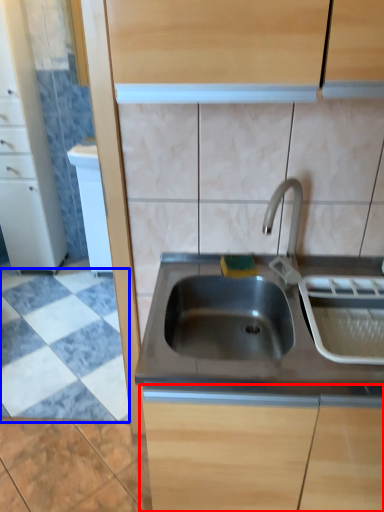
Question: Which of the following is the closest to the observer, cabinetry (highlighted by a red box) or ceramic tile (highlighted by a blue box)?

Choices:
 (A) cabinetry
 (B) ceramic tile

Answer: (A)